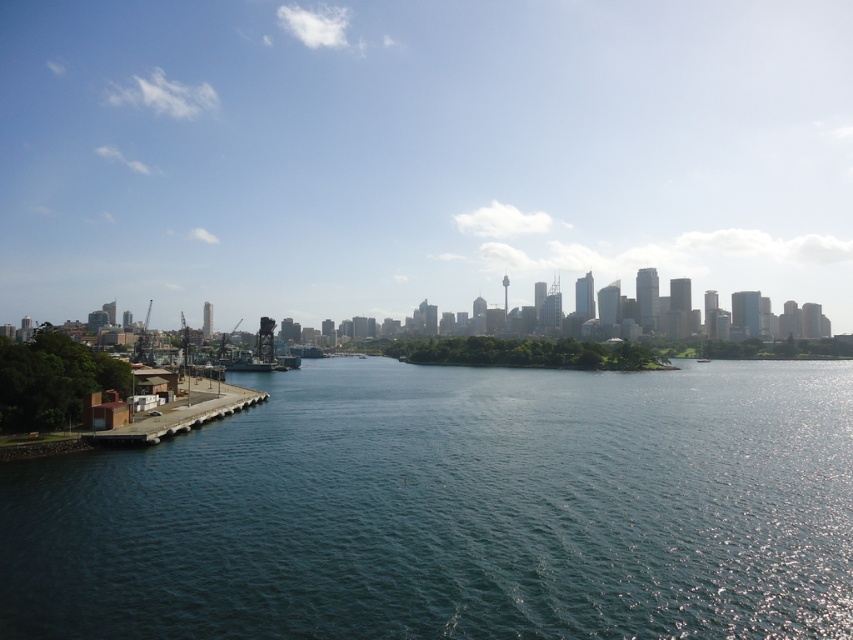
Is transparent glass skyline at upper center closer to the viewer compared to brown concrete dock at lower left?

No, it is behind brown concrete dock at lower left.

Does transparent glass skyline at upper center appear on the left side of brown concrete dock at lower left?

No, transparent glass skyline at upper center is not to the left of brown concrete dock at lower left.

Does point (775, 68) come in front of point (180, 410)?

No, (775, 68) is behind (180, 410).

You are a GUI agent. You are given a task and a screenshot of the screen. Output one action in this format:
    pyautogui.click(x=<x>, y=<y>)
    Task: Click on the transparent glass skyline at upper center
    This screenshot has height=640, width=853.
    Given the screenshot: What is the action you would take?
    pyautogui.click(x=416, y=154)

Which is in front, point (706, 225) or point (154, 468)?

Point (154, 468)

Is transparent glass skyline at upper center shorter than dark blue water at center?

No.

What do you see at coordinates (416, 154) in the screenshot? I see `transparent glass skyline at upper center` at bounding box center [416, 154].

Where is `transparent glass skyline at upper center`? This screenshot has width=853, height=640. transparent glass skyline at upper center is located at coordinates (416, 154).

Between point (33, 620) and point (146, 435), which one is positioned in front?

Point (33, 620)

Is dark blue water at center above brown concrete dock at lower left?

Actually, dark blue water at center is below brown concrete dock at lower left.

Does point (517, 582) lie in front of point (85, 436)?

Yes, point (517, 582) is in front of point (85, 436).

Where is `dark blue water at center`? The image size is (853, 640). dark blue water at center is located at coordinates (456, 509).